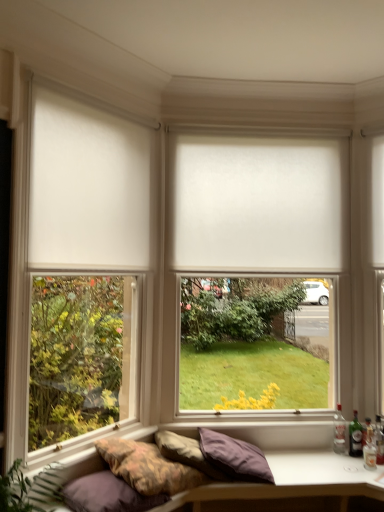
You are a GUI agent. You are given a task and a screenshot of the screen. Output one action in this format:
    pyautogui.click(x=<x>, y=<y>)
    Task: Click on the vacant area situated to the left side of clear glass bottle at lower right, placed as the first bottle when sorted from left to right
    
    Given the screenshot: What is the action you would take?
    pyautogui.click(x=314, y=453)